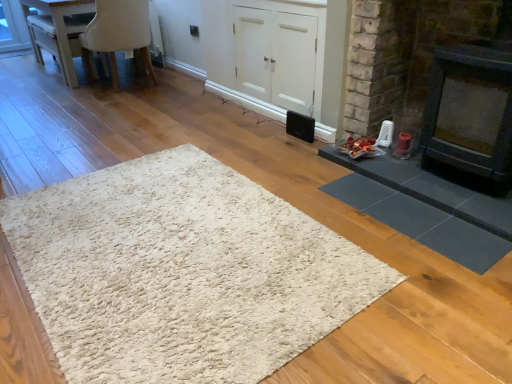
Question: Is white glossy table at upper left not within beige fabric chair at upper left?

Choices:
 (A) yes
 (B) no

Answer: (A)

Question: Does white glossy table at upper left have a greater height compared to beige fabric chair at upper left?

Choices:
 (A) no
 (B) yes

Answer: (A)

Question: Considering the relative sizes of white glossy table at upper left and beige fabric chair at upper left in the image provided, is white glossy table at upper left smaller than beige fabric chair at upper left?

Choices:
 (A) no
 (B) yes

Answer: (B)

Question: Is white glossy table at upper left positioned behind beige fabric chair at upper left?

Choices:
 (A) yes
 (B) no

Answer: (A)

Question: Is white glossy table at upper left positioned far away from beige fabric chair at upper left?

Choices:
 (A) no
 (B) yes

Answer: (A)

Question: Is white shaggy rug at center, the 1th mat when ordered from left to right, spatially inside white matte cabinet at center, or outside of it?

Choices:
 (A) outside
 (B) inside

Answer: (A)

Question: From the image's perspective, is white shaggy rug at center, positioned as the 2th mat in right-to-left order, above or below white matte cabinet at center?

Choices:
 (A) above
 (B) below

Answer: (B)

Question: Is white shaggy rug at center, the 1th mat when ordered from left to right, taller or shorter than white matte cabinet at center?

Choices:
 (A) tall
 (B) short

Answer: (B)

Question: Relative to white matte cabinet at center, is white shaggy rug at center, the 1th mat when ordered from left to right, in front or behind?

Choices:
 (A) behind
 (B) front

Answer: (B)

Question: From a real-world perspective, relative to black matte fireplace at right, the first fireplace when ordered from right to left, is white matte cabinet at center vertically above or below?

Choices:
 (A) below
 (B) above

Answer: (A)

Question: Considering the positions of white matte cabinet at center and black matte fireplace at right, the first fireplace when ordered from right to left, in the image, is white matte cabinet at center bigger or smaller than black matte fireplace at right, the first fireplace when ordered from right to left,?

Choices:
 (A) big
 (B) small

Answer: (A)

Question: Would you say white matte cabinet at center is to the left or to the right of black matte fireplace at right, the second fireplace positioned from the left, in the picture?

Choices:
 (A) left
 (B) right

Answer: (A)

Question: Relative to black matte fireplace at right, the second fireplace positioned from the left, is white matte cabinet at center in front or behind?

Choices:
 (A) front
 (B) behind

Answer: (B)

Question: Based on their sizes in the image, would you say white shaggy rug at center, the 1th mat when ordered from left to right, is bigger or smaller than dark gray stone fireplace at right, which appears as the 2th fireplace when viewed from the right?

Choices:
 (A) big
 (B) small

Answer: (B)

Question: Which is correct: white shaggy rug at center, positioned as the 2th mat in right-to-left order, is inside dark gray stone fireplace at right, which appears as the 2th fireplace when viewed from the right, or outside of it?

Choices:
 (A) inside
 (B) outside

Answer: (B)